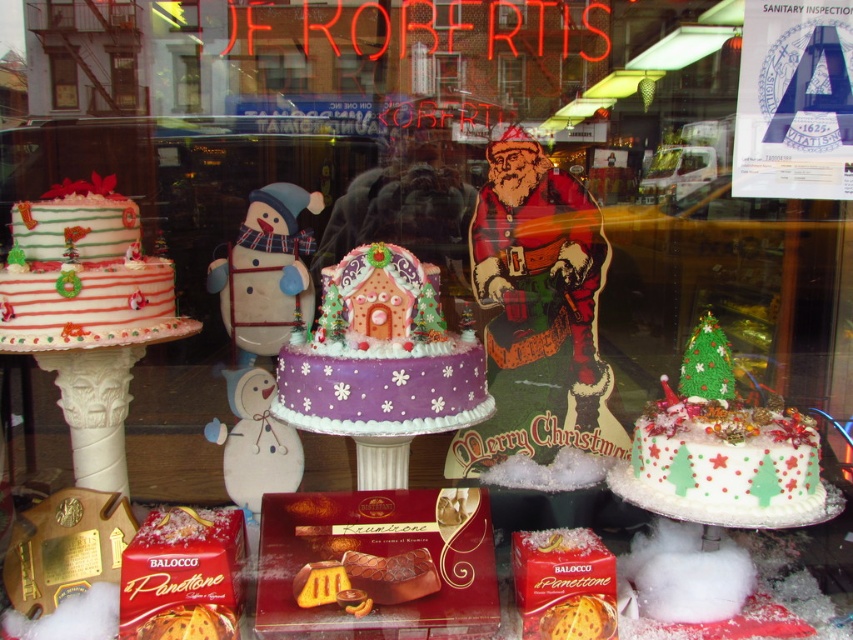
You are a customer standing outside the bakery window. You see the white frosted cake with green and red decorations at center and the matte glass window at center. Which object is closer to the right side of the window?

The white frosted cake with green and red decorations at center is closer to the right side of the window because it is positioned to the right of the matte glass window at center.

You are standing in front of the bakery window and want to take a closer look at the white fabric snowman at center. If your maximum reach is 2 meters, can you touch it without any assistance?

The white fabric snowman at center is 2.41 meters away from the camera, which is beyond your maximum reach of 2 meters. You would need assistance to touch it.